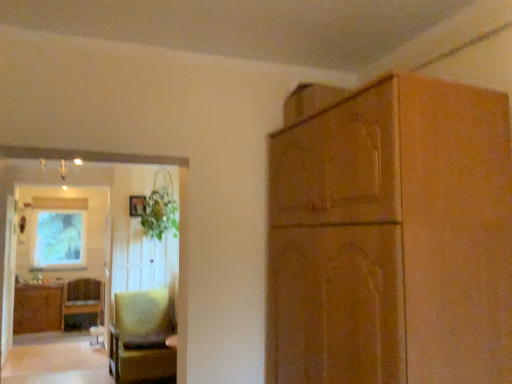
Question: Is there a large distance between woven wicker cabinet at lower left, the 2th cabinetry positioned from the front, and matte green painting at upper left?

Choices:
 (A) yes
 (B) no

Answer: (B)

Question: Is woven wicker cabinet at lower left, the 2th cabinetry positioned from the front, taller than matte green painting at upper left?

Choices:
 (A) yes
 (B) no

Answer: (B)

Question: Is woven wicker cabinet at lower left, the 2th cabinetry positioned from the front, with matte green painting at upper left?

Choices:
 (A) no
 (B) yes

Answer: (A)

Question: Is woven wicker cabinet at lower left, placed as the second cabinetry when sorted from top to bottom, smaller than matte green painting at upper left?

Choices:
 (A) yes
 (B) no

Answer: (B)

Question: Is woven wicker cabinet at lower left, the 2th cabinetry positioned from the front, to the left of matte green painting at upper left from the viewer's perspective?

Choices:
 (A) yes
 (B) no

Answer: (A)

Question: In the image, is velvet yellow chair at lower left, which appears as the second chair when viewed from the back, on the left side or the right side of woven wicker cabinet at lower left, which is the 2th cabinetry from right to left?

Choices:
 (A) left
 (B) right

Answer: (B)

Question: Is point (138, 370) closer or farther from the camera than point (47, 306)?

Choices:
 (A) closer
 (B) farther

Answer: (A)

Question: Is velvet yellow chair at lower left, which appears as the second chair when viewed from the back, situated inside woven wicker cabinet at lower left, which is the 2th cabinetry from right to left, or outside?

Choices:
 (A) outside
 (B) inside

Answer: (A)

Question: In terms of size, does velvet yellow chair at lower left, which is the 1th chair from right to left, appear bigger or smaller than woven wicker cabinet at lower left, arranged as the first cabinetry when ordered from the bottom?

Choices:
 (A) small
 (B) big

Answer: (B)

Question: From the image's perspective, is wooden chair at lower left, the first chair when ordered from left to right, located above or below matte green painting at upper left?

Choices:
 (A) above
 (B) below

Answer: (B)

Question: In terms of height, does wooden chair at lower left, the second chair viewed from the right, look taller or shorter compared to matte green painting at upper left?

Choices:
 (A) tall
 (B) short

Answer: (B)

Question: Considering the relative positions of wooden chair at lower left, the second chair viewed from the right, and matte green painting at upper left in the image provided, is wooden chair at lower left, the second chair viewed from the right, to the left or to the right of matte green painting at upper left?

Choices:
 (A) left
 (B) right

Answer: (B)

Question: Would you say wooden chair at lower left, the second chair viewed from the right, is inside or outside matte green painting at upper left?

Choices:
 (A) inside
 (B) outside

Answer: (B)

Question: In terms of width, does matte green painting at upper left look wider or thinner when compared to wooden cabinet at upper right, which is the 2th cabinetry in bottom-to-top order?

Choices:
 (A) wide
 (B) thin

Answer: (B)

Question: Is point (62, 248) closer or farther from the camera than point (463, 316)?

Choices:
 (A) farther
 (B) closer

Answer: (A)